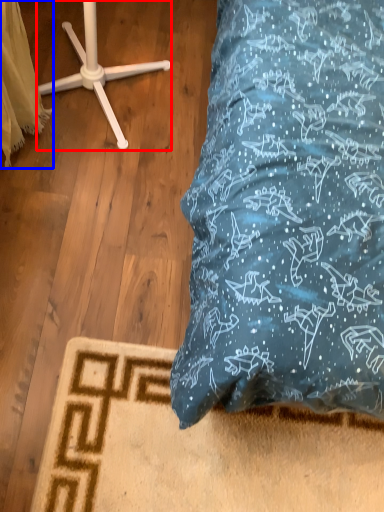
Question: Which object appears farthest to the camera in this image, furniture (highlighted by a red box) or material (highlighted by a blue box)?

Choices:
 (A) furniture
 (B) material

Answer: (A)